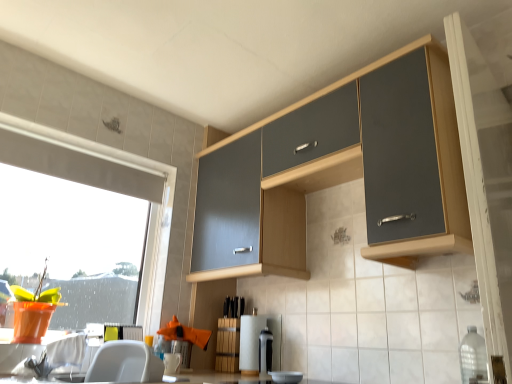
Question: Choose the correct answer: Is white paper towel at center, the first appliance in the left-to-right sequence, inside transparent glass window at left or outside it?

Choices:
 (A) inside
 (B) outside

Answer: (B)

Question: From a real-world perspective, is white paper towel at center, the 2th appliance when ordered from right to left, above or below transparent glass window at left?

Choices:
 (A) above
 (B) below

Answer: (B)

Question: Which object is the closest to the white glossy countertop at lower center?

Choices:
 (A) matte wood screen door at upper right
 (B) satin black coffee maker at lower center, the second appliance from the left
 (C) white paper towel at center, the first appliance in the left-to-right sequence
 (D) clear plastic bottle at lower right
 (E) matte gray cabinet at upper center

Answer: (C)

Question: Which is nearer to the clear plastic bottle at lower right?

Choices:
 (A) satin black coffee maker at lower center, which is counted as the 1th appliance, starting from the right
 (B) matte wood screen door at upper right
 (C) white glossy countertop at lower center
 (D) transparent glass window at left
 (E) white paper towel at center, the 2th appliance when ordered from right to left

Answer: (B)